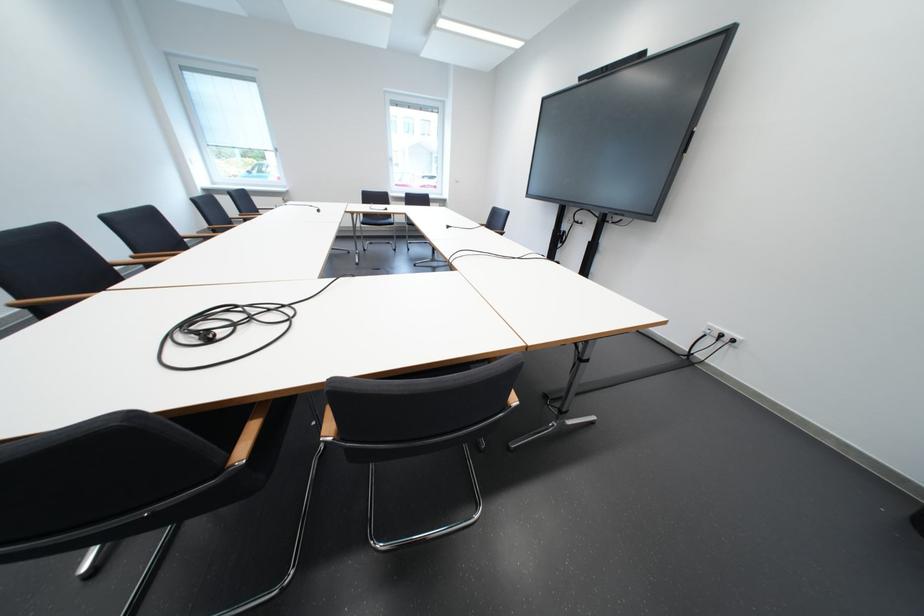
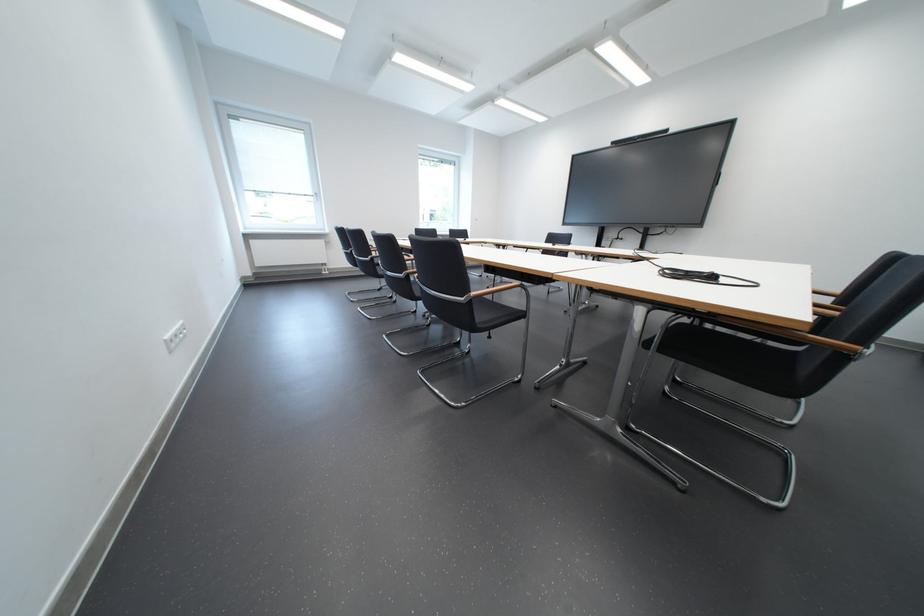
Question: What movement of the cameraman would produce the second image?

Choices:
 (A) Left
 (B) Right
 (C) Forward
 (D) Backward

Answer: (A)